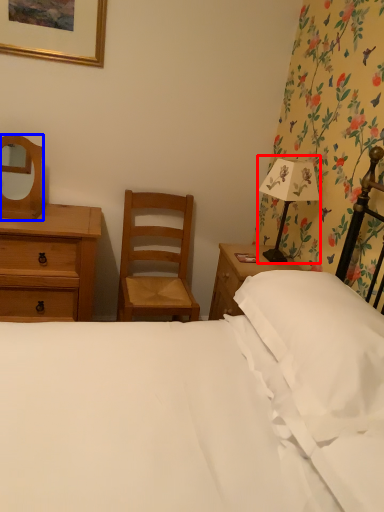
Question: Which object is further to the camera taking this photo, bedside lamp (highlighted by a red box) or mirror (highlighted by a blue box)?

Choices:
 (A) bedside lamp
 (B) mirror

Answer: (B)